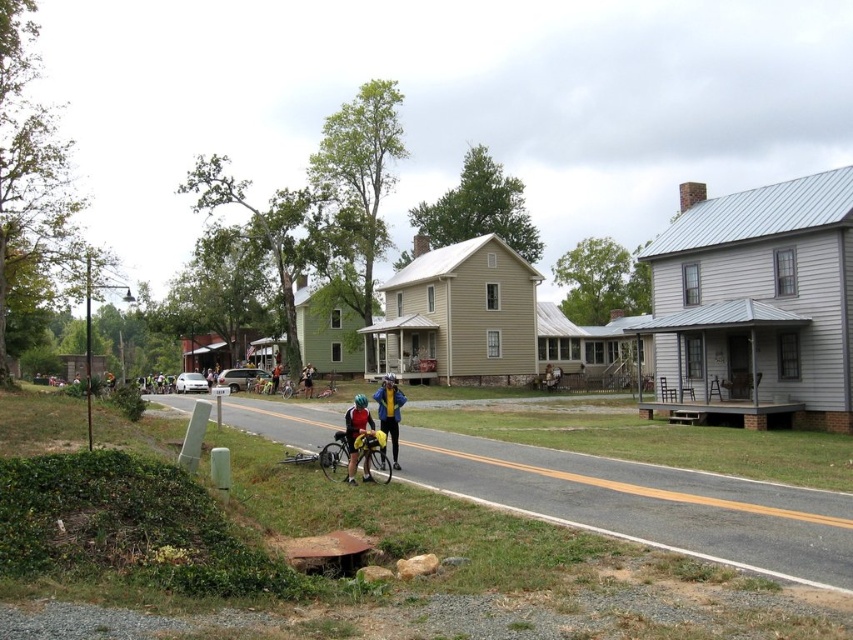
Question: Is yellow fabric jacket at center to the right of orange reflective vest at center from the viewer's perspective?

Choices:
 (A) no
 (B) yes

Answer: (B)

Question: Which point is farther to the camera?

Choices:
 (A) yellow fabric jacket at center
 (B) orange reflective vest at center

Answer: (B)

Question: Is yellow matte bicycle at center smaller than orange reflective vest at center?

Choices:
 (A) yes
 (B) no

Answer: (A)

Question: Which object is farther from the camera taking this photo?

Choices:
 (A) shiny black bicycle at center
 (B) orange reflective vest at center
 (C) yellow fabric jacket at center

Answer: (B)

Question: Estimate the real-world distances between objects in this image. Which object is closer to the yellow matte bicycle at center?

Choices:
 (A) yellow fabric helmet at center
 (B) shiny black bicycle at center
 (C) orange reflective vest at center
 (D) yellow fabric jacket at center

Answer: (D)

Question: Where is yellow matte bicycle at center located in relation to matte yellow helmet at center in the image?

Choices:
 (A) right
 (B) left

Answer: (A)